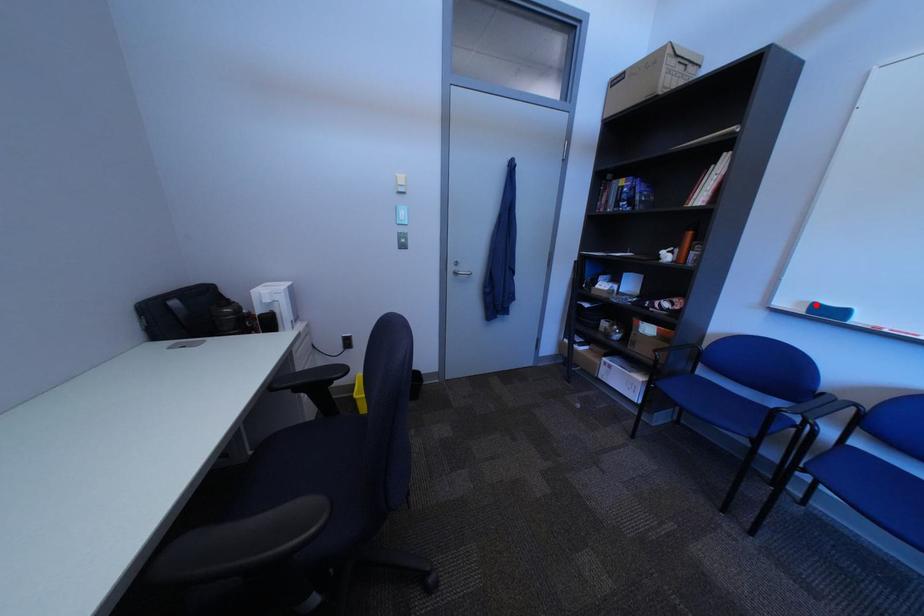
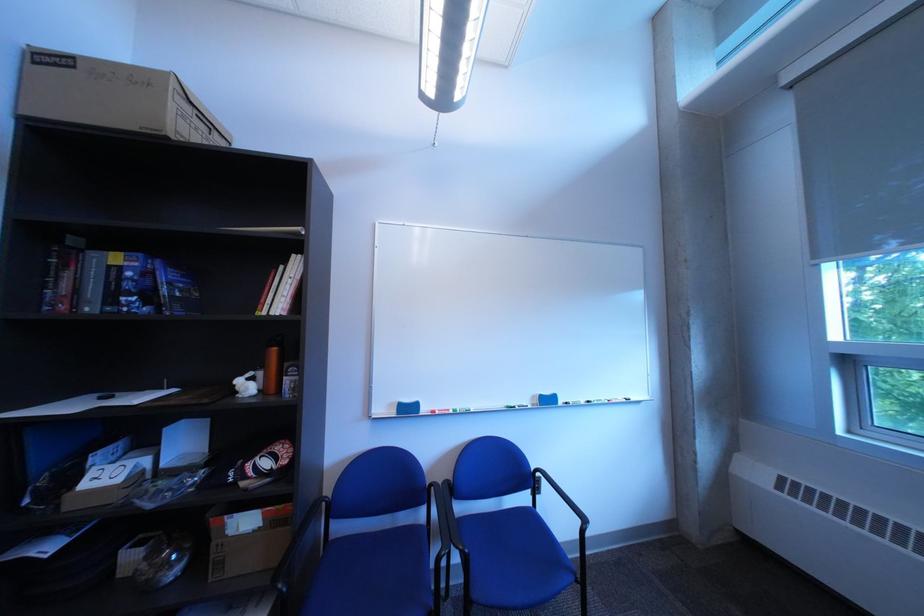
Find the pixel in the second image that matches the highlighted location in the first image.

(406, 407)